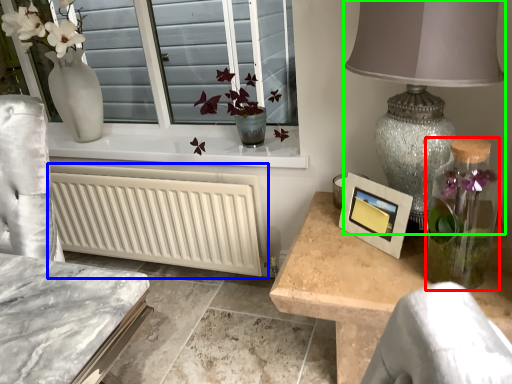
Question: Which object is the farthest from glass vase (highlighted by a red box)? Choose among these: radiator (highlighted by a blue box) or table lamp (highlighted by a green box).

Choices:
 (A) radiator
 (B) table lamp

Answer: (A)